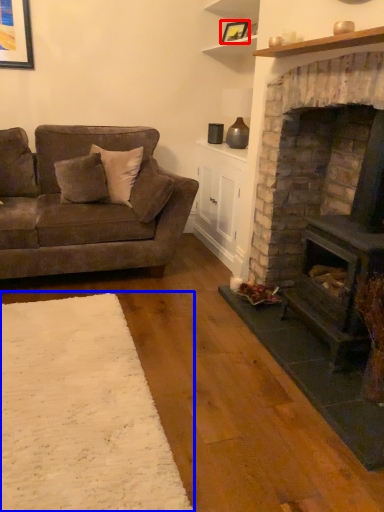
Question: Which of the following is the farthest to the observer, picture frame (highlighted by a red box) or plain (highlighted by a blue box)?

Choices:
 (A) picture frame
 (B) plain

Answer: (A)